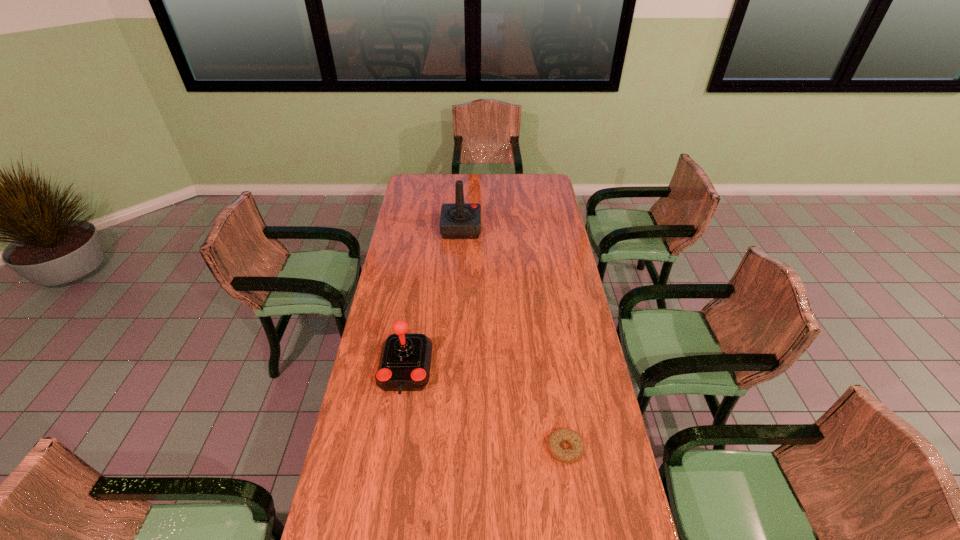
Identify the location of vacant area in the image that satisfies the following two spatial constraints: 1. on the front-facing side of the farther joystick; 2. on the base of the nearer joystick. This screenshot has width=960, height=540. (454, 369).